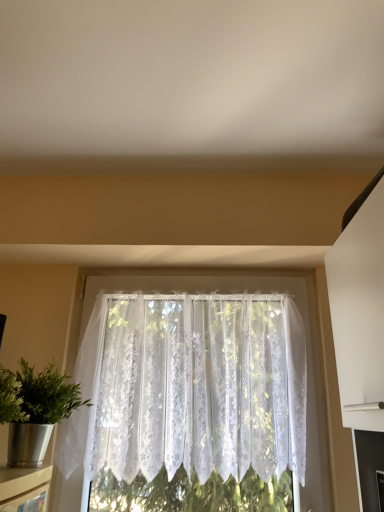
Question: Does metallic silver houseplant at left appear on the left side of white lace curtain at center?

Choices:
 (A) yes
 (B) no

Answer: (A)

Question: Can you confirm if metallic silver houseplant at left is thinner than white lace curtain at center?

Choices:
 (A) no
 (B) yes

Answer: (A)

Question: From a real-world perspective, is metallic silver houseplant at left on white lace curtain at center?

Choices:
 (A) yes
 (B) no

Answer: (B)

Question: From the image's perspective, is metallic silver houseplant at left on top of white lace curtain at center?

Choices:
 (A) yes
 (B) no

Answer: (A)

Question: Does metallic silver houseplant at left have a larger size compared to white lace curtain at center?

Choices:
 (A) no
 (B) yes

Answer: (A)

Question: From their relative heights in the image, would you say metallic silver houseplant at left is taller or shorter than white lace curtain at center?

Choices:
 (A) short
 (B) tall

Answer: (A)

Question: Considering the relative positions of metallic silver houseplant at left and white lace curtain at center in the image provided, is metallic silver houseplant at left to the left or to the right of white lace curtain at center?

Choices:
 (A) right
 (B) left

Answer: (B)

Question: Looking at their shapes, would you say metallic silver houseplant at left is wider or thinner than white lace curtain at center?

Choices:
 (A) wide
 (B) thin

Answer: (A)

Question: In the image, is metallic silver houseplant at left positioned in front of or behind white lace curtain at center?

Choices:
 (A) behind
 (B) front

Answer: (B)

Question: From their relative heights in the image, would you say white lace curtain at center is taller or shorter than metallic silver houseplant at left?

Choices:
 (A) short
 (B) tall

Answer: (B)

Question: In terms of width, does white lace curtain at center look wider or thinner when compared to metallic silver houseplant at left?

Choices:
 (A) wide
 (B) thin

Answer: (B)

Question: Considering the positions of point (200, 352) and point (31, 380), is point (200, 352) closer or farther from the camera than point (31, 380)?

Choices:
 (A) closer
 (B) farther

Answer: (B)

Question: Considering their positions, is white lace curtain at center located in front of or behind metallic silver houseplant at left?

Choices:
 (A) front
 (B) behind

Answer: (B)

Question: Considering their positions, is metallic silver shelf at lower left located in front of or behind white lace curtain at center?

Choices:
 (A) behind
 (B) front

Answer: (B)

Question: Would you say metallic silver shelf at lower left is to the left or to the right of white lace curtain at center in the picture?

Choices:
 (A) left
 (B) right

Answer: (A)